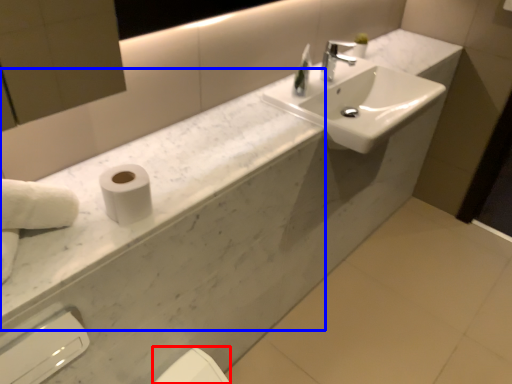
Question: Which of the following is the farthest to the observer, bidet (highlighted by a red box) or counter top (highlighted by a blue box)?

Choices:
 (A) bidet
 (B) counter top

Answer: (A)